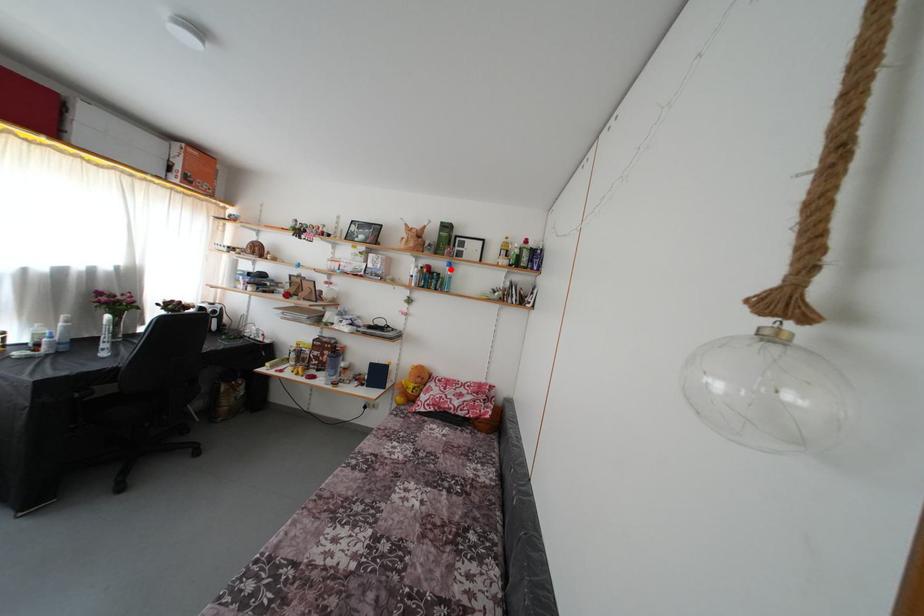
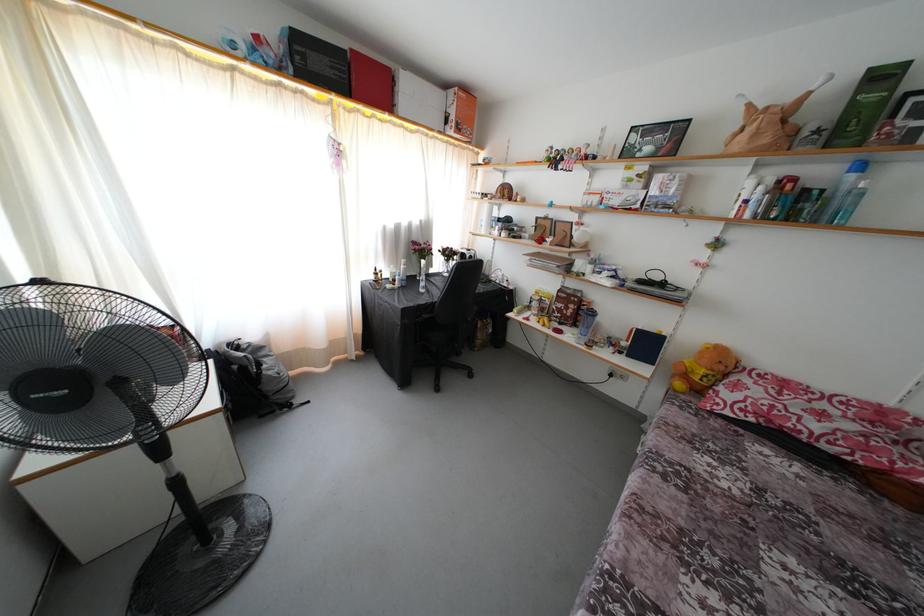
The point at the highlighted location is marked in the first image. Where is the corresponding point in the second image?

(849, 172)